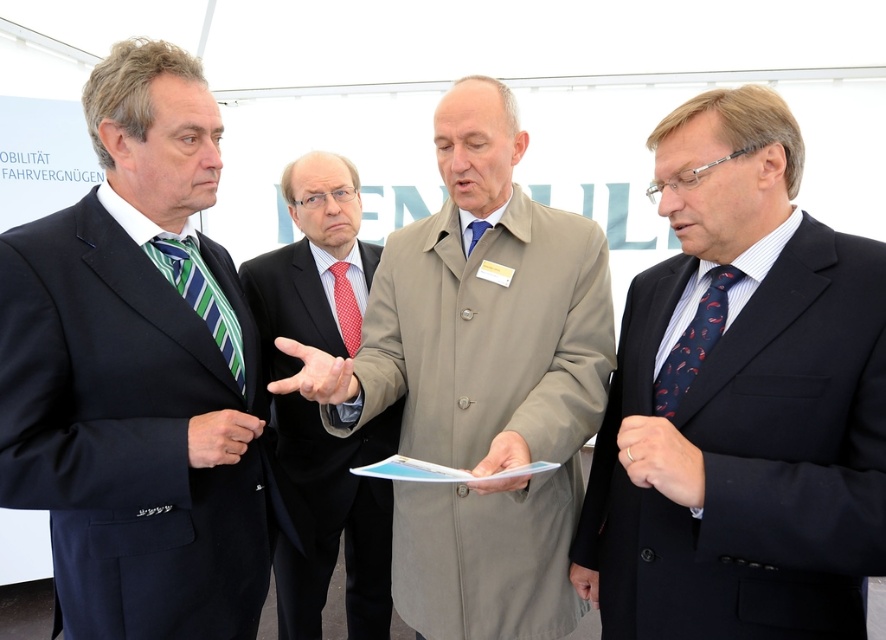
Question: Is polished dark suit at center to the left of red dotted tie at center from the viewer's perspective?

Choices:
 (A) no
 (B) yes

Answer: (B)

Question: Estimate the real-world distances between objects in this image. Which object is closer to the red dotted tie at center?

Choices:
 (A) dark blue suit at right
 (B) blue silk tie at center
 (C) beige coat at center
 (D) green striped tie at left

Answer: (B)

Question: Which object is positioned farthest from the blue silk tie at center?

Choices:
 (A) polished dark suit at center
 (B) beige coat at center
 (C) green striped tie at left
 (D) dark blue suit at left

Answer: (A)

Question: Does polished dark suit at center have a greater width compared to red dotted tie at center?

Choices:
 (A) yes
 (B) no

Answer: (A)

Question: Can you confirm if beige coat at center is positioned to the right of red dotted tie at center?

Choices:
 (A) no
 (B) yes

Answer: (B)

Question: Estimate the real-world distances between objects in this image. Which object is farther from the navy silk tie at right?

Choices:
 (A) blue silk tie at center
 (B) red dotted tie at center
 (C) dark blue suit at left
 (D) dark blue suit at right

Answer: (B)